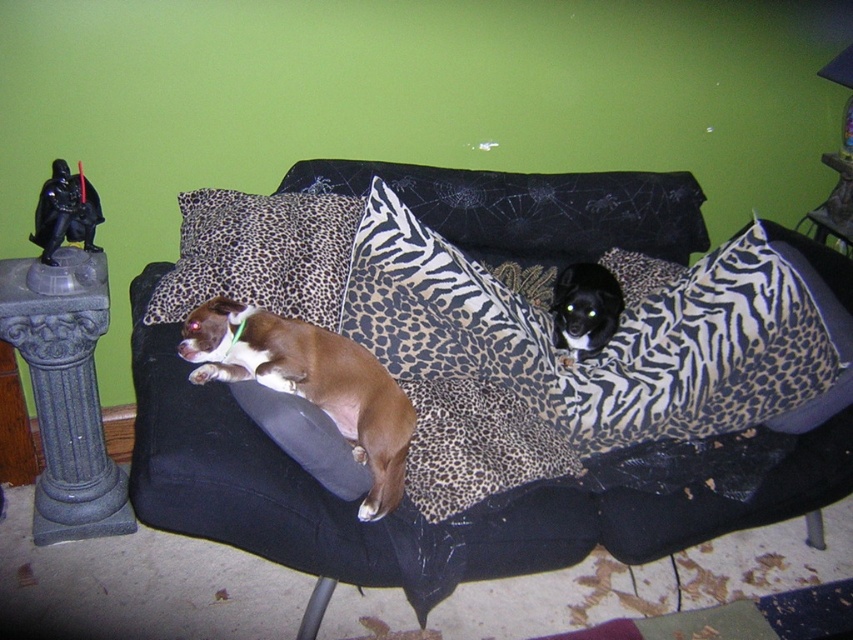
Question: Estimate the real-world distances between objects in this image. Which object is farther from the leopard print fabric pillow at center?

Choices:
 (A) leopard print fabric couch at center
 (B) brown furry dog at center
 (C) black fur dog at center

Answer: (C)

Question: Does leopard print fabric couch at center have a larger size compared to black fur dog at center?

Choices:
 (A) no
 (B) yes

Answer: (B)

Question: Where is leopard print fabric couch at center located in relation to leopard print fabric pillow at center in the image?

Choices:
 (A) right
 (B) left

Answer: (A)

Question: Which of the following is the closest to the observer?

Choices:
 (A) (701, 305)
 (B) (236, 269)
 (C) (263, 336)

Answer: (C)

Question: Which point is closer to the camera taking this photo?

Choices:
 (A) (300, 390)
 (B) (352, 214)

Answer: (A)

Question: Can you confirm if leopard print fabric couch at center is positioned below leopard print fabric pillow at center?

Choices:
 (A) no
 (B) yes

Answer: (B)